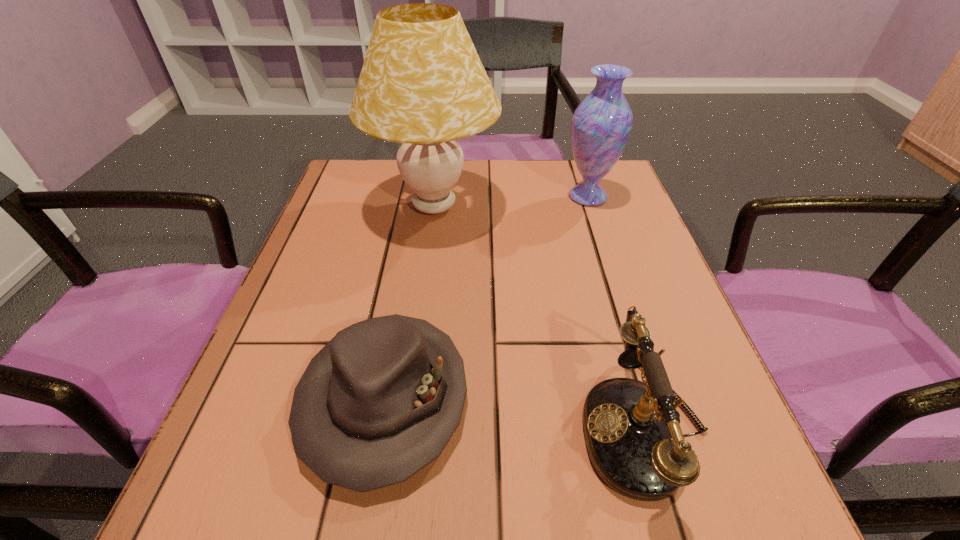
Locate an element on the screen. vase situated at the far edge is located at coordinates (601, 124).

The image size is (960, 540). What are the coordinates of `telephone present at the near edge` in the screenshot? It's located at coord(632,429).

This screenshot has width=960, height=540. I want to click on hat present at the near edge, so click(380, 401).

I want to click on lampshade positioned at the left edge, so click(x=422, y=84).

Locate an element on the screen. This screenshot has height=540, width=960. hat positioned at the left edge is located at coordinates (380, 401).

In order to click on vase that is at the right edge in this screenshot , I will do `click(601, 124)`.

Where is `telephone at the right edge`? This screenshot has width=960, height=540. telephone at the right edge is located at coordinates pos(632,429).

Find the location of a particular element. The width and height of the screenshot is (960, 540). object at the far left corner is located at coordinates (422, 84).

What are the coordinates of `object present at the near left corner` in the screenshot? It's located at (380, 401).

In order to click on object that is at the far right corner in this screenshot , I will do `click(601, 124)`.